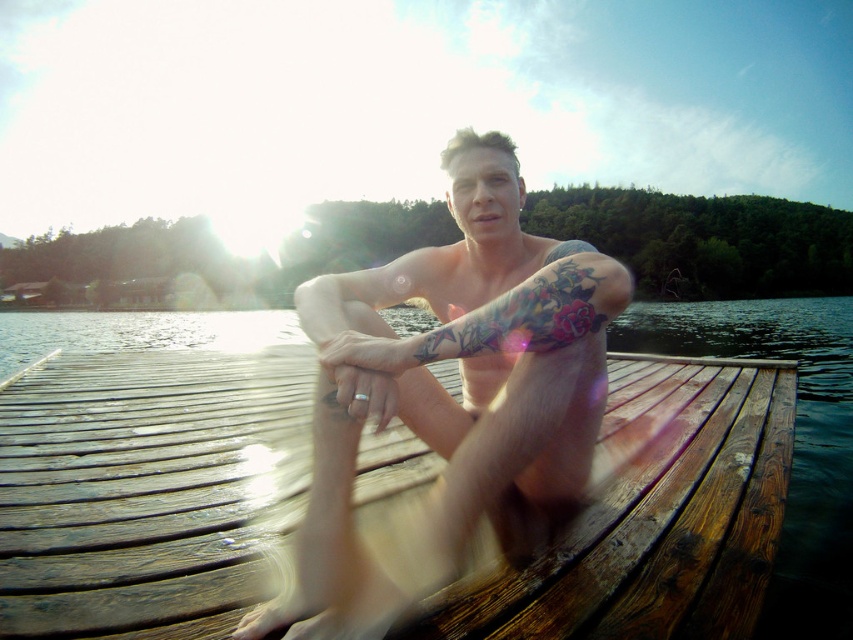
Question: Is brown wooden dock at center thinner than smooth skin man at center?

Choices:
 (A) yes
 (B) no

Answer: (B)

Question: Is brown wooden dock at center further to camera compared to smooth skin man at center?

Choices:
 (A) no
 (B) yes

Answer: (B)

Question: Which object is farther from the camera taking this photo?

Choices:
 (A) brown wooden dock at center
 (B) smooth skin man at center

Answer: (A)

Question: Observing the image, what is the correct spatial positioning of brown wooden dock at center in reference to smooth skin man at center?

Choices:
 (A) below
 (B) above

Answer: (A)